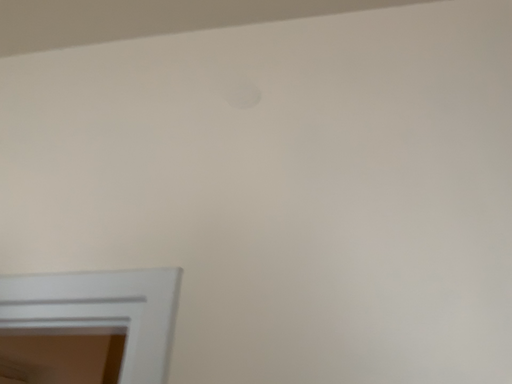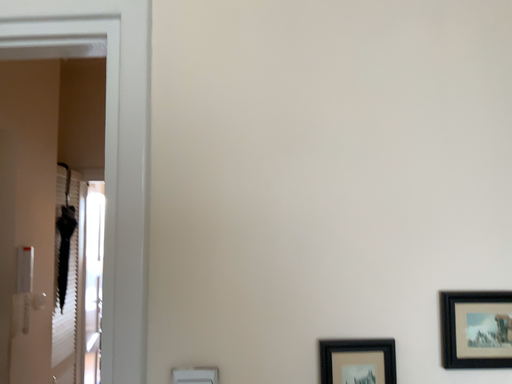
Question: Which way did the camera rotate in the video?

Choices:
 (A) rotated left
 (B) rotated right

Answer: (B)